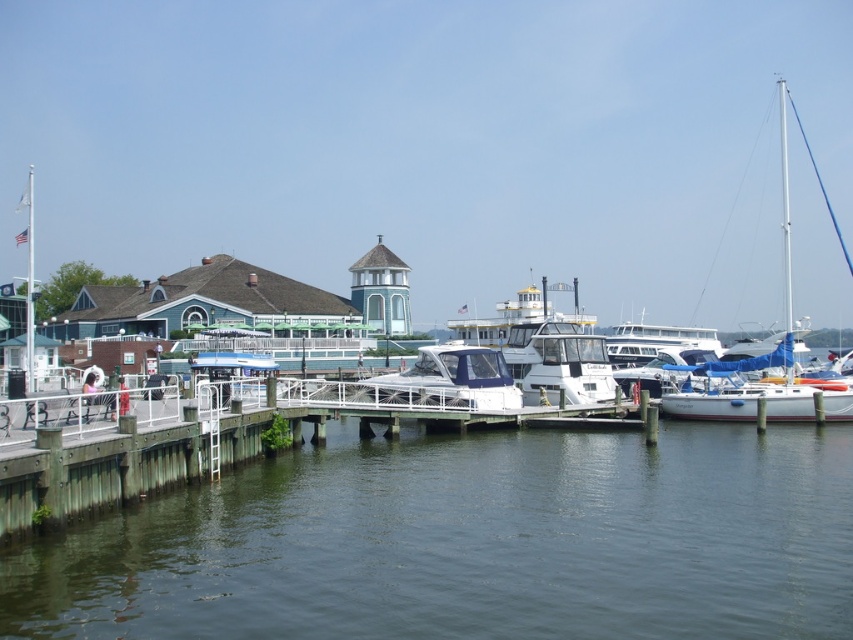
Is clear water at dock center below wooden dock at lower left?

Correct, clear water at dock center is located below wooden dock at lower left.

Which is above, clear water at dock center or wooden dock at lower left?

wooden dock at lower left

Where is `clear water at dock center`? clear water at dock center is located at coordinates (469, 541).

Which is in front, point (357, 483) or point (790, 314)?

Point (357, 483) is more forward.

Who is taller, clear water at dock center or white matte sailboat at right?

white matte sailboat at right is taller.

Is point (757, 580) positioned behind point (798, 416)?

No, it is not.

At what (x,y) coordinates should I click in order to perform the action: click on clear water at dock center. Please return your answer as a coordinate pair (x, y). The height and width of the screenshot is (640, 853). Looking at the image, I should click on (469, 541).

Can you confirm if wooden dock at lower left is shorter than white matte sailboat at right?

Yes, wooden dock at lower left is shorter than white matte sailboat at right.

Does wooden dock at lower left appear on the left side of white matte sailboat at right?

Yes, wooden dock at lower left is to the left of white matte sailboat at right.

Is point (28, 512) positioned before point (770, 400)?

Yes, point (28, 512) is in front of point (770, 400).

Find the location of a particular element. wooden dock at lower left is located at coordinates (132, 464).